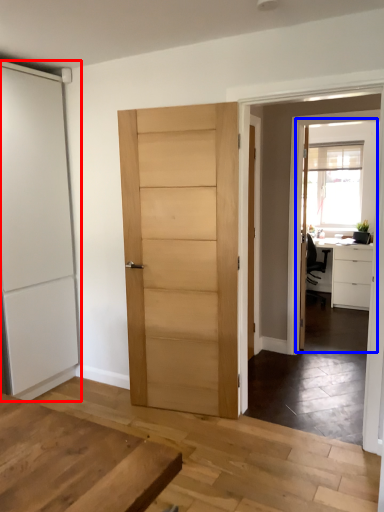
Question: Which object appears closest to the camera in this image, door (highlighted by a red box) or screen door (highlighted by a blue box)?

Choices:
 (A) door
 (B) screen door

Answer: (A)